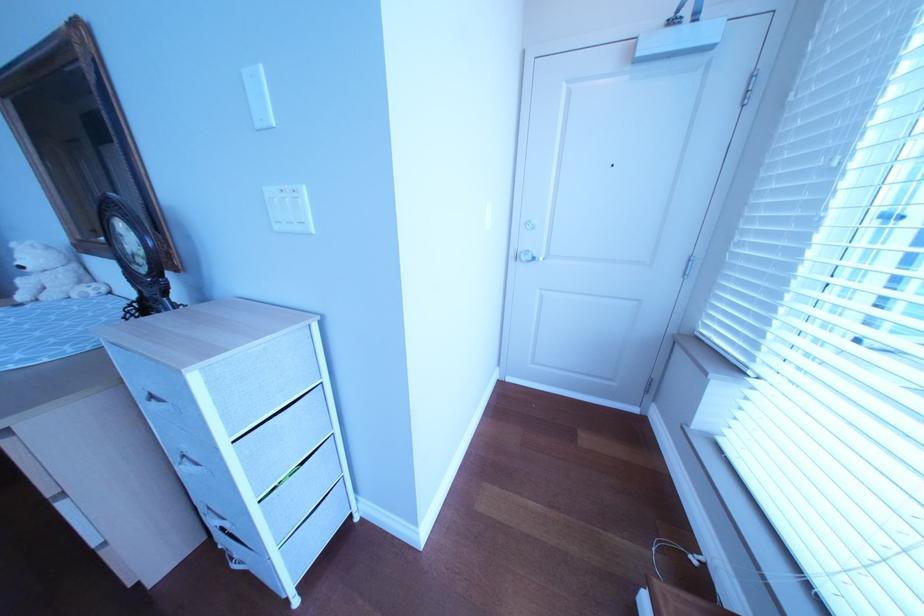
This screenshot has width=924, height=616. Describe the element at coordinates (675, 551) in the screenshot. I see `a blind adjustment cords` at that location.